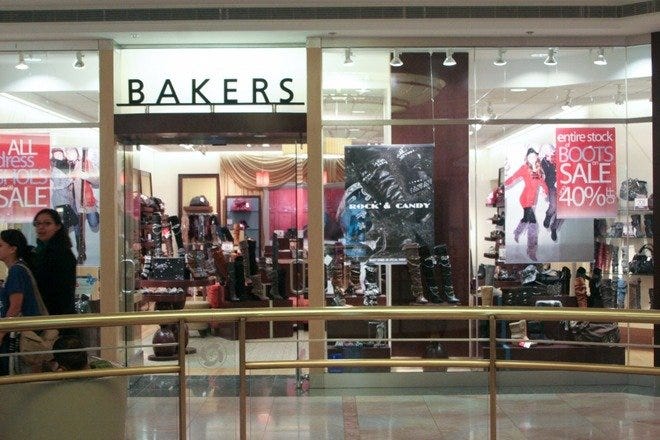
Where is `wall`? This screenshot has height=440, width=660. wall is located at coordinates (350, 23).